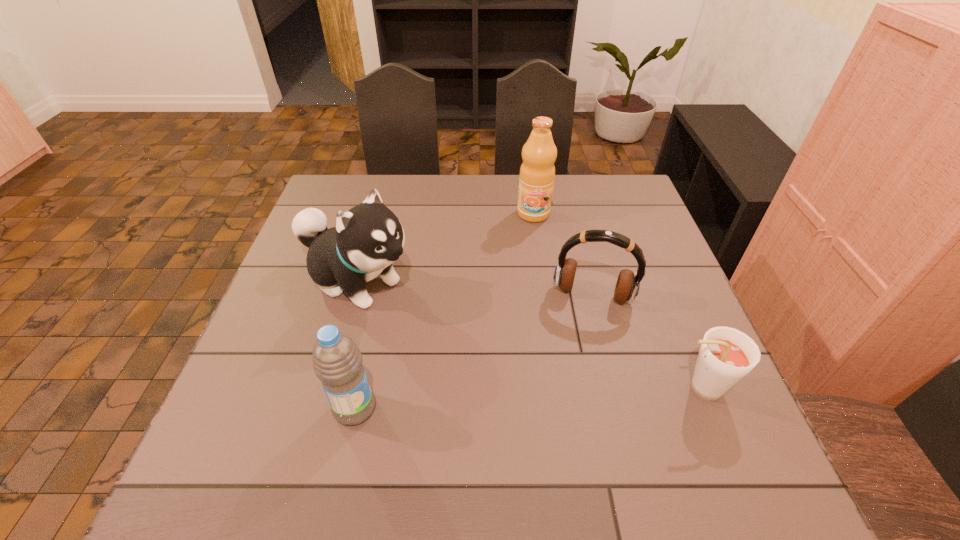
You are a GUI agent. You are given a task and a screenshot of the screen. Output one action in this format:
    pyautogui.click(x=<x>, y=<y>)
    Task: Click on the vacant area at the far right corner
    
    Given the screenshot: What is the action you would take?
    pyautogui.click(x=626, y=202)

The height and width of the screenshot is (540, 960). I want to click on free space between the water bottle and the headset, so click(x=473, y=352).

I want to click on blank region between the third tallest object and the rightmost object, so click(527, 398).

You are a GUI agent. You are given a task and a screenshot of the screen. Output one action in this format:
    pyautogui.click(x=<x>, y=<y>)
    Task: Click on the free area in between the headset and the water bottle
    This screenshot has height=540, width=960.
    Given the screenshot: What is the action you would take?
    pyautogui.click(x=473, y=352)

I want to click on free spot between the puppy and the fruit juice, so click(444, 247).

You are a GUI agent. You are given a task and a screenshot of the screen. Output one action in this format:
    pyautogui.click(x=<x>, y=<y>)
    Task: Click on the free space that is in between the water bottle and the headset
    The height and width of the screenshot is (540, 960).
    Given the screenshot: What is the action you would take?
    pyautogui.click(x=473, y=352)

I want to click on free spot between the puppy and the root beer, so click(x=527, y=335).

I want to click on vacant space that is in between the third shortest object and the headset, so click(473, 352).

Find the location of `empty space that is in between the puppy and the farthest object`. empty space that is in between the puppy and the farthest object is located at coordinates (444, 247).

Identify which object is the closest to the puppy. Please provide its 2D coordinates. Your answer should be formatted as a tuple, i.e. [(x, y)], where the tuple contains the x and y coordinates of a point satisfying the conditions above.

[(337, 361)]